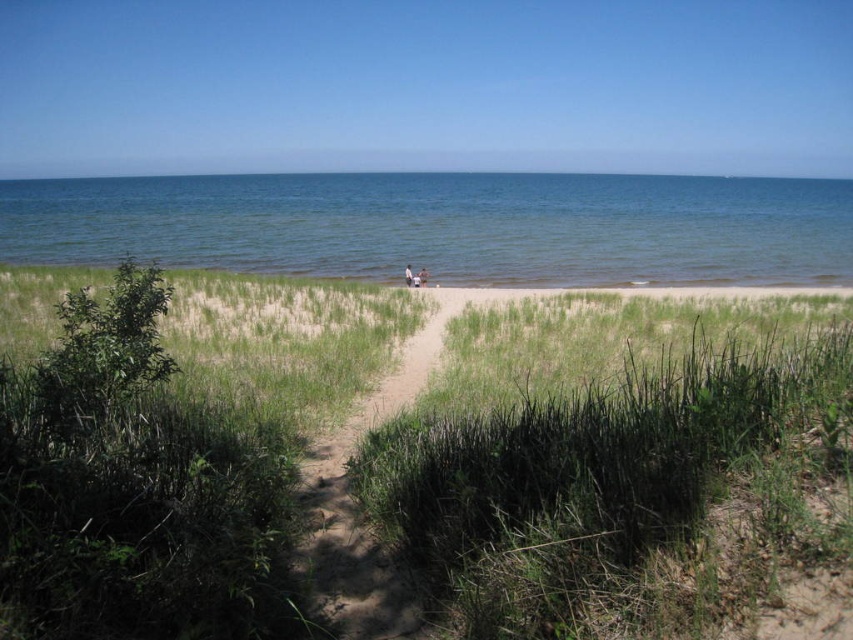
From the picture: Which of these two, blue water at center or light brown sand at center, stands taller?

blue water at center is taller.

Which of these two, blue water at center or light brown sand at center, stands shorter?

light brown sand at center

What are the coordinates of `blue water at center` in the screenshot? It's located at (445, 225).

This screenshot has width=853, height=640. I want to click on blue water at center, so click(445, 225).

Who is higher up, green grassy beach at center or light brown wooden bench at center?

light brown wooden bench at center

Who is more forward, (28, 294) or (416, 284)?

Positioned in front is point (28, 294).

The width and height of the screenshot is (853, 640). I want to click on green grassy beach at center, so click(x=277, y=358).

The width and height of the screenshot is (853, 640). I want to click on green grassy beach at center, so click(x=277, y=358).

From the picture: Can you confirm if green grassy beach at center is taller than light brown sand at center?

Indeed, green grassy beach at center has a greater height compared to light brown sand at center.

Does green grassy beach at center have a lesser width compared to light brown sand at center?

No.

Does point (392, 301) come in front of point (416, 278)?

Yes, it is in front of point (416, 278).

Identify the location of green grassy beach at center. This screenshot has height=640, width=853. (277, 358).